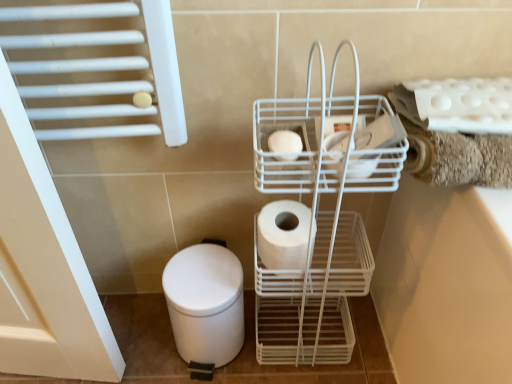
Question: Is white matte bidet at lower left outside white wire trolley at center?

Choices:
 (A) yes
 (B) no

Answer: (A)

Question: Is white matte bidet at lower left aimed at white wire trolley at center?

Choices:
 (A) no
 (B) yes

Answer: (A)

Question: Is white matte bidet at lower left thinner than white wire trolley at center?

Choices:
 (A) yes
 (B) no

Answer: (B)

Question: Is white matte bidet at lower left further to camera compared to white wire trolley at center?

Choices:
 (A) no
 (B) yes

Answer: (B)

Question: Could white wire trolley at center be considered to be inside white matte bidet at lower left?

Choices:
 (A) no
 (B) yes

Answer: (A)

Question: Is white matte bidet at lower left at the left side of white wire trolley at center?

Choices:
 (A) no
 (B) yes

Answer: (B)

Question: Is white matte bidet at lower left positioned with its back to white matte toilet paper at center, which is counted as the 2th toilet paper, starting from the front?

Choices:
 (A) yes
 (B) no

Answer: (B)

Question: Considering the relative positions of white matte bidet at lower left and white matte toilet paper at center, the 1th toilet paper in the bottom-to-top sequence, in the image provided, is white matte bidet at lower left in front of white matte toilet paper at center, the 1th toilet paper in the bottom-to-top sequence,?

Choices:
 (A) yes
 (B) no

Answer: (B)

Question: Is white matte bidet at lower left outside white matte toilet paper at center, which is counted as the 2th toilet paper, starting from the front?

Choices:
 (A) no
 (B) yes

Answer: (B)

Question: Is white matte bidet at lower left far from white matte toilet paper at center, which is the 1th toilet paper in back-to-front order?

Choices:
 (A) yes
 (B) no

Answer: (B)

Question: Can you confirm if white matte bidet at lower left is thinner than white matte toilet paper at center, arranged as the 2th toilet paper when viewed from the top?

Choices:
 (A) no
 (B) yes

Answer: (A)

Question: Could you tell me if white matte bidet at lower left is turned towards white matte toilet paper at center, which is counted as the 2th toilet paper, starting from the front?

Choices:
 (A) no
 (B) yes

Answer: (A)

Question: Is white wire trolley at center positioned in front of white matte toilet paper at center, which is the 2th toilet paper in bottom-to-top order?

Choices:
 (A) no
 (B) yes

Answer: (B)